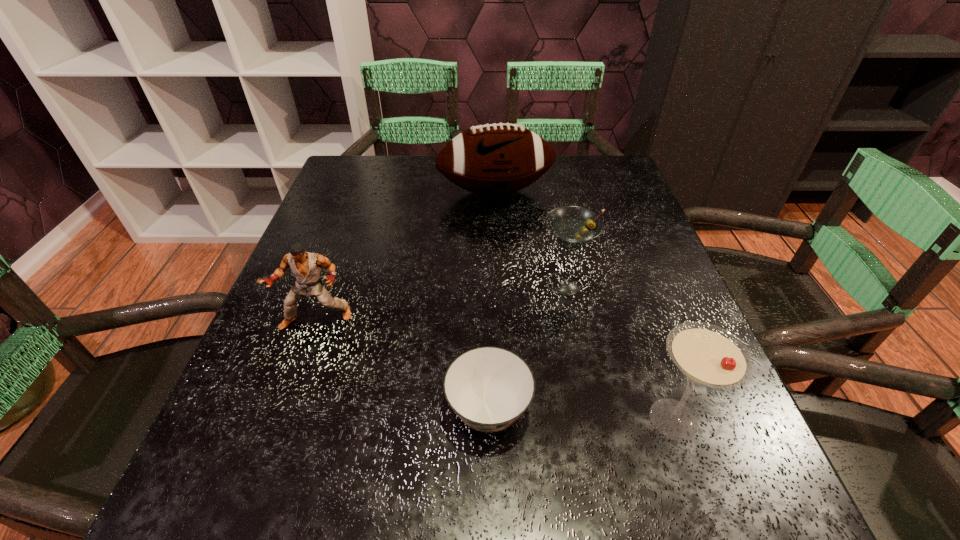
Find the location of a particular element. This screenshot has width=960, height=540. the farthest object is located at coordinates (493, 159).

Find the location of a particular element. the fourth nearest object is located at coordinates (573, 227).

Locate an element on the screen. This screenshot has height=540, width=960. the left martini is located at coordinates (573, 227).

You are a GUI agent. You are given a task and a screenshot of the screen. Output one action in this format:
    pyautogui.click(x=<x>, y=<y>)
    Task: Click on the puncher
    The width and height of the screenshot is (960, 540).
    Given the screenshot: What is the action you would take?
    pyautogui.click(x=306, y=267)

Image resolution: width=960 pixels, height=540 pixels. Find the location of `the leftmost object`. the leftmost object is located at coordinates (306, 267).

Locate an element on the screen. the rightmost object is located at coordinates (707, 355).

Where is `the right martini`? This screenshot has width=960, height=540. the right martini is located at coordinates (707, 355).

Image resolution: width=960 pixels, height=540 pixels. I want to click on the shortest object, so click(489, 388).

Identify the location of vacant space located 0.340m on the front of the football (American). The height and width of the screenshot is (540, 960). (501, 316).

The image size is (960, 540). I want to click on vacant area situated 0.350m on the back of the left martini, so coord(543,180).